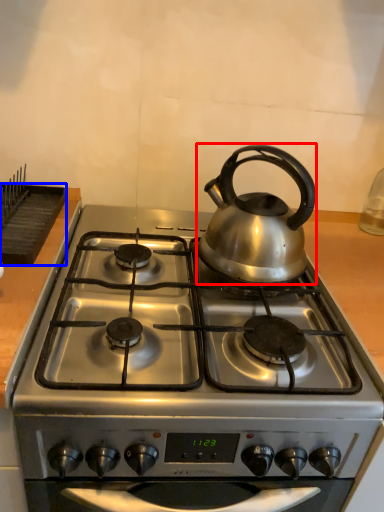
Question: Among these objects, which one is nearest to the camera, kettle (highlighted by a red box) or kitchen appliance (highlighted by a blue box)?

Choices:
 (A) kettle
 (B) kitchen appliance

Answer: (A)